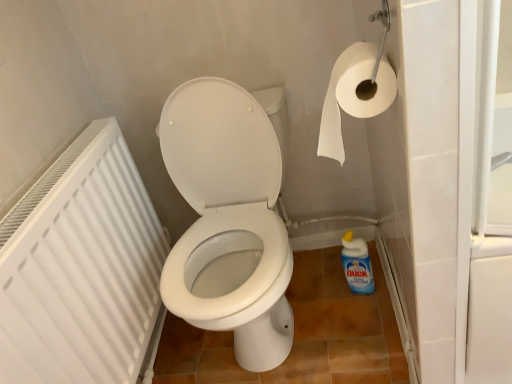
What are the coordinates of `white paper at upper right` in the screenshot? It's located at (353, 95).

The height and width of the screenshot is (384, 512). In order to click on white paper at upper right in this screenshot , I will do `click(353, 95)`.

From a real-world perspective, which is physically below, white plastic radiator at left or blue glossy bottle at lower right?

From a 3D spatial view, blue glossy bottle at lower right is below.

Is white plastic radiator at left spatially inside blue glossy bottle at lower right, or outside of it?

white plastic radiator at left is spatially situated outside blue glossy bottle at lower right.

From the image's perspective, between white plastic radiator at left and blue glossy bottle at lower right, who is located below?

blue glossy bottle at lower right, from the image's perspective.

Could you tell me if white plastic radiator at left is facing blue glossy bottle at lower right?

Yes.

Which is more to the right, white paper at upper right or blue glossy bottle at lower right?

From the viewer's perspective, blue glossy bottle at lower right appears more on the right side.

Is white paper at upper right oriented towards blue glossy bottle at lower right?

No.

Which is in front, white paper at upper right or blue glossy bottle at lower right?

white paper at upper right.

From a real-world perspective, relative to white plastic radiator at left, is white paper at upper right vertically above or below?

In terms of real-world spatial position, white paper at upper right is above white plastic radiator at left.

Measure the distance from white paper at upper right to white plastic radiator at left.

white paper at upper right and white plastic radiator at left are 69.51 centimeters apart.

Does white paper at upper right have a greater width compared to white plastic radiator at left?

Correct, the width of white paper at upper right exceeds that of white plastic radiator at left.

Considering the relative positions of white paper at upper right and white plastic radiator at left in the image provided, is white paper at upper right to the left of white plastic radiator at left from the viewer's perspective?

In fact, white paper at upper right is to the right of white plastic radiator at left.

Is white plastic radiator at left directly adjacent to white paper at upper right?

white plastic radiator at left is not next to white paper at upper right, and they're not touching.

From the image's perspective, is white plastic radiator at left above white paper at upper right?

Actually, white plastic radiator at left appears below white paper at upper right in the image.

Which of these two, white plastic radiator at left or white paper at upper right, is wider?

With larger width is white paper at upper right.

Is white plastic radiator at left in front of or behind white paper at upper right in the image?

Visually, white plastic radiator at left is located in front of white paper at upper right.

Is blue glossy bottle at lower right aimed at white plastic radiator at left?

No.

Which point is more distant from viewer, (348, 268) or (140, 254)?

The point (348, 268) is more distant.

Is blue glossy bottle at lower right to the right of white plastic radiator at left from the viewer's perspective?

Indeed, blue glossy bottle at lower right is positioned on the right side of white plastic radiator at left.

Is point (354, 270) positioned after point (384, 82)?

Yes.

From the picture: Considering the positions of objects blue glossy bottle at lower right and white paper at upper right in the image provided, who is more to the right, blue glossy bottle at lower right or white paper at upper right?

blue glossy bottle at lower right is more to the right.

Relative to white paper at upper right, is blue glossy bottle at lower right in front or behind?

blue glossy bottle at lower right is positioned farther from the viewer than white paper at upper right.

From a real-world perspective, who is located lower, blue glossy bottle at lower right or white paper at upper right?

blue glossy bottle at lower right is physically lower.

Locate an element on the screen. radiator located in front of the blue glossy bottle at lower right is located at coordinates (82, 270).

Where is `toilet paper located above the blue glossy bottle at lower right (from the image's perspective)`? toilet paper located above the blue glossy bottle at lower right (from the image's perspective) is located at coordinates (353, 95).

From the image, which object appears to be farther from white paper at upper right, blue glossy bottle at lower right or white plastic radiator at left?

blue glossy bottle at lower right is further to white paper at upper right.

From the image, which object appears to be farther from white paper at upper right, white plastic radiator at left or blue glossy bottle at lower right?

Among the two, blue glossy bottle at lower right is located further to white paper at upper right.

Based on their spatial positions, is white plastic radiator at left or white paper at upper right closer to blue glossy bottle at lower right?

white paper at upper right.

In the scene shown: Which object lies further to the anchor point white plastic radiator at left, white paper at upper right or blue glossy bottle at lower right?

blue glossy bottle at lower right.

Which object lies further to the anchor point blue glossy bottle at lower right, white paper at upper right or white plastic radiator at left?

white plastic radiator at left.

Based on their spatial positions, is blue glossy bottle at lower right or white paper at upper right further from white plastic radiator at left?

Among the two, blue glossy bottle at lower right is located further to white plastic radiator at left.

Where is `toilet paper between white plastic radiator at left and blue glossy bottle at lower right from left to right`? toilet paper between white plastic radiator at left and blue glossy bottle at lower right from left to right is located at coordinates (353, 95).